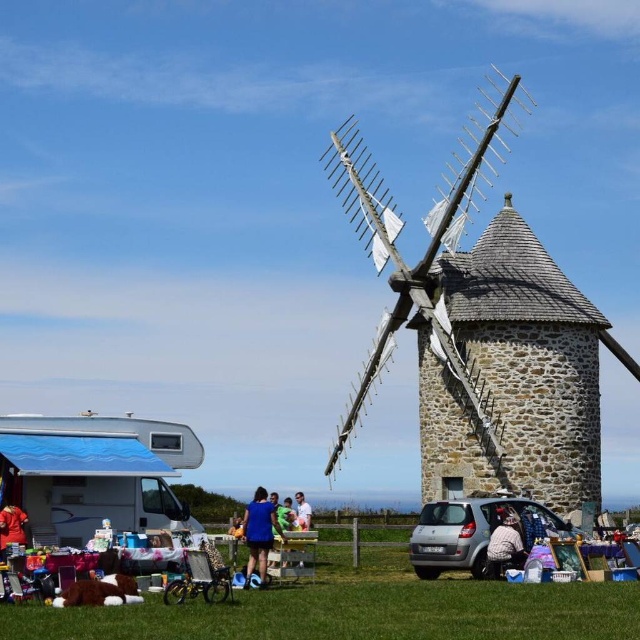
Does point (477, 513) come closer to viewer compared to point (16, 513)?

No, it is not.

This screenshot has width=640, height=640. What do you see at coordinates (474, 531) in the screenshot?
I see `silver metallic car at lower center` at bounding box center [474, 531].

Find the location of a particular element. This screenshot has width=640, height=640. silver metallic car at lower center is located at coordinates (474, 531).

Is blue fabric shirt at center above white cotton shirt at lower center?

Actually, blue fabric shirt at center is below white cotton shirt at lower center.

Who is positioned more to the left, blue fabric shirt at center or white cotton shirt at lower center?

blue fabric shirt at center

Who is more distant from viewer, (276,529) or (497,550)?

Positioned behind is point (276,529).

The height and width of the screenshot is (640, 640). Find the location of `blue fabric shirt at center`. blue fabric shirt at center is located at coordinates (259, 532).

Who is more distant from viewer, (388, 284) or (428, 536)?

Positioned behind is point (388, 284).

Does wooden windmill at center have a lesser width compared to silver metallic car at lower center?

Incorrect, wooden windmill at center's width is not less than silver metallic car at lower center's.

Between point (497, 120) and point (432, 541), which one is positioned in front?

Point (432, 541)

You are a GUI agent. You are given a task and a screenshot of the screen. Output one action in this format:
    pyautogui.click(x=<x>, y=<y>)
    Task: Click on the wooden windmill at center
    The image size is (640, 640).
    Given the screenshot: What is the action you would take?
    pyautogui.click(x=403, y=259)